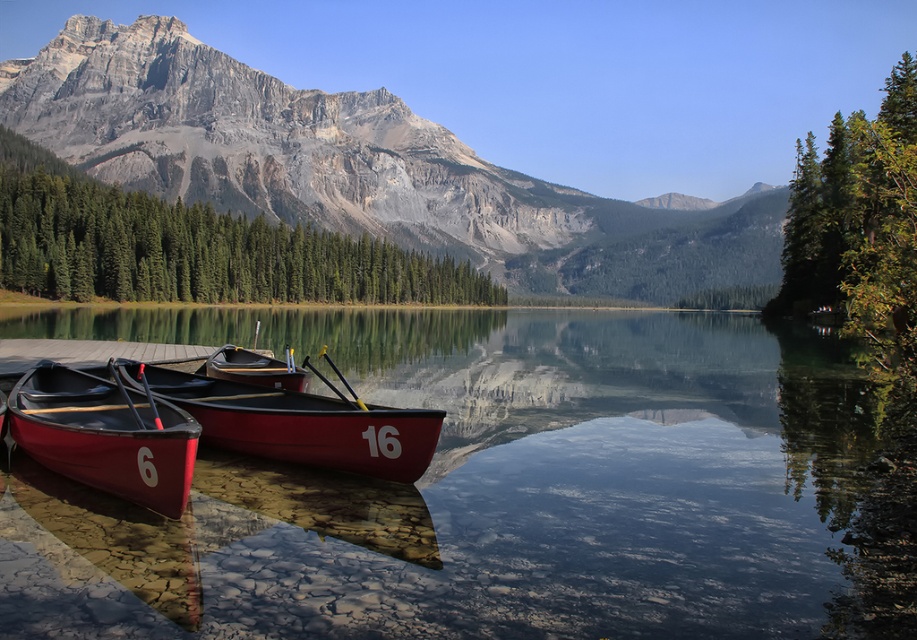
Consider the image. Can you confirm if matte red canoe at left is positioned below matte red canoe at center?

Actually, matte red canoe at left is above matte red canoe at center.

Is matte red canoe at left positioned at the back of matte red canoe at center?

No.

Which is behind, point (75, 480) or point (278, 451)?

Point (278, 451)

The width and height of the screenshot is (917, 640). I want to click on matte red canoe at left, so click(105, 435).

Does transparent glass water at center have a greater width compared to matte red canoe at center?

Yes, transparent glass water at center is wider than matte red canoe at center.

Can you confirm if transparent glass water at center is bigger than matte red canoe at center?

Correct, transparent glass water at center is larger in size than matte red canoe at center.

At what (x,y) coordinates should I click in order to perform the action: click on transparent glass water at center. Please return your answer as a coordinate pair (x, y). This screenshot has height=640, width=917. Looking at the image, I should click on (503, 490).

Locate an element on the screen. transparent glass water at center is located at coordinates (503, 490).

Is matte gray rock at upper center taller than matte red canoe at center?

Yes.

Which is in front, point (115, 76) or point (390, 448)?

Point (390, 448)

The image size is (917, 640). In order to click on matte gray rock at upper center in this screenshot , I will do `click(362, 168)`.